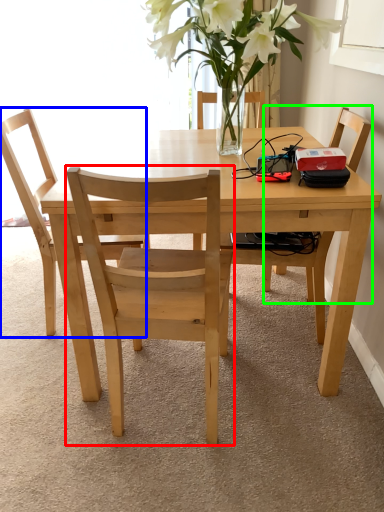
Question: Estimate the real-world distances between objects in this image. Which object is closer to chair (highlighted by a red box), chair (highlighted by a blue box) or chair (highlighted by a green box)?

Choices:
 (A) chair
 (B) chair

Answer: (A)